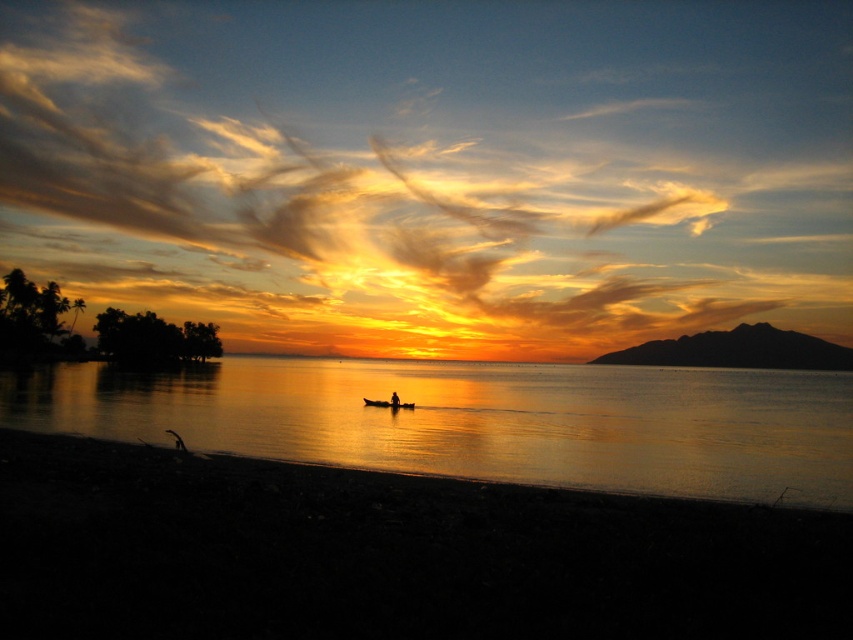
You are standing at the edge of the coast, looking out at the sunset. There are two points marked on your map. The first point is at coordinates point (668, 404) and the second is at point (392, 394). Which point is farther away from you?

Point (668, 404) is behind point (392, 394), so it is farther away from you.

Consider the image. You are an astronomer observing the sunset and notice the golden cotton clouds at upper center and the silhouette human at center. Which object appears larger in the sky?

The golden cotton clouds at upper center appears much taller than the silhouette human at center in the sky.

You are standing on a cliff overlooking the silky smooth water at center. You want to throw a pebble to create a ripple. Considering the distance, can you reach the water with your throw?

The silky smooth water at center is 11.07 meters away from the viewer. Depending on your throwing strength, if you can throw a pebble at least 11.07 meters, you can reach the water to create a ripple.